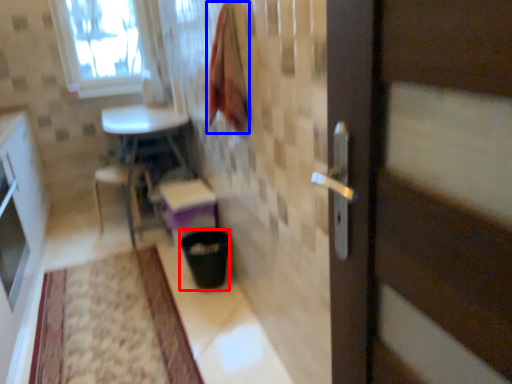
Question: Which point is further to the camera, trash bin/can (highlighted by a red box) or blanket (highlighted by a blue box)?

Choices:
 (A) trash bin/can
 (B) blanket

Answer: (A)